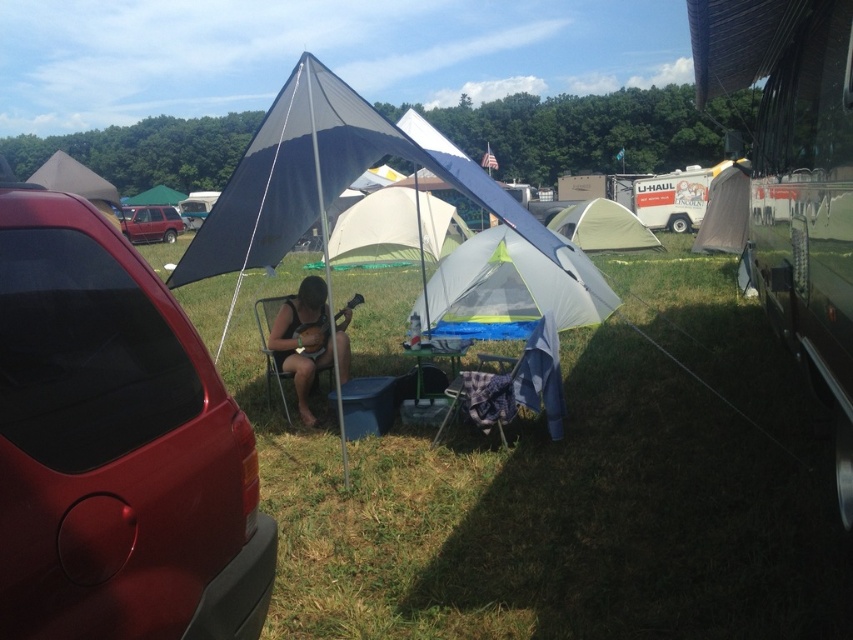
Question: Is matte black guitar at center positioned at the back of green fabric tent at center?

Choices:
 (A) no
 (B) yes

Answer: (A)

Question: Which object is closer to the camera taking this photo?

Choices:
 (A) gray fabric tent at center
 (B) matte red car at left
 (C) green grass at lower center

Answer: (B)

Question: Is white mesh tent at center below green fabric tent at center?

Choices:
 (A) no
 (B) yes

Answer: (B)

Question: From the image, what is the correct spatial relationship of matte red car at left in relation to green fabric tent at center?

Choices:
 (A) below
 (B) above

Answer: (A)

Question: Which object is the farthest from the green plastic picnic table at center?

Choices:
 (A) white mesh tent at center
 (B) gray fabric tent at center
 (C) green fabric tent at center
 (D) matte red suv at left

Answer: (D)

Question: Among these points, which one is nearest to the camera?

Choices:
 (A) (608, 198)
 (B) (323, 364)

Answer: (B)